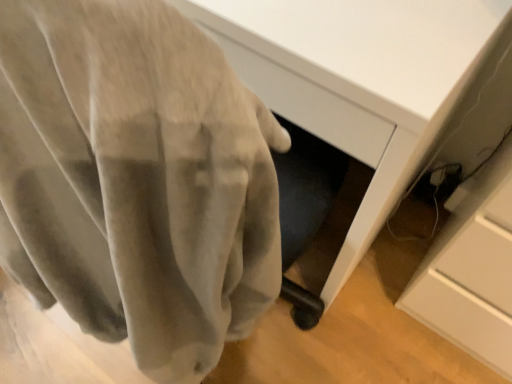
Question: From the image's perspective, is velvet gray curtain at center located beneath matte white desk at center?

Choices:
 (A) no
 (B) yes

Answer: (B)

Question: Is velvet gray curtain at center behind matte white desk at center?

Choices:
 (A) no
 (B) yes

Answer: (A)

Question: Does velvet gray curtain at center have a lesser width compared to matte white desk at center?

Choices:
 (A) no
 (B) yes

Answer: (B)

Question: From a real-world perspective, is velvet gray curtain at center located higher than matte white desk at center?

Choices:
 (A) yes
 (B) no

Answer: (A)

Question: Can you confirm if velvet gray curtain at center is positioned to the left of matte white desk at center?

Choices:
 (A) yes
 (B) no

Answer: (A)

Question: Considering the relative sizes of velvet gray curtain at center and matte white desk at center in the image provided, is velvet gray curtain at center shorter than matte white desk at center?

Choices:
 (A) yes
 (B) no

Answer: (A)

Question: Does matte white desk at center have a greater width compared to velvet gray curtain at center?

Choices:
 (A) yes
 (B) no

Answer: (A)

Question: Is matte white desk at center at the right side of velvet gray curtain at center?

Choices:
 (A) no
 (B) yes

Answer: (B)

Question: Does matte white desk at center have a smaller size compared to velvet gray curtain at center?

Choices:
 (A) no
 (B) yes

Answer: (A)

Question: Considering the relative positions of matte white desk at center and velvet gray curtain at center in the image provided, is matte white desk at center behind velvet gray curtain at center?

Choices:
 (A) yes
 (B) no

Answer: (A)

Question: From the image's perspective, is matte white desk at center beneath velvet gray curtain at center?

Choices:
 (A) no
 (B) yes

Answer: (A)

Question: Does matte white desk at center have a greater height compared to velvet gray curtain at center?

Choices:
 (A) yes
 (B) no

Answer: (A)

Question: Is velvet gray curtain at center to the left or to the right of matte white desk at center in the image?

Choices:
 (A) right
 (B) left

Answer: (B)